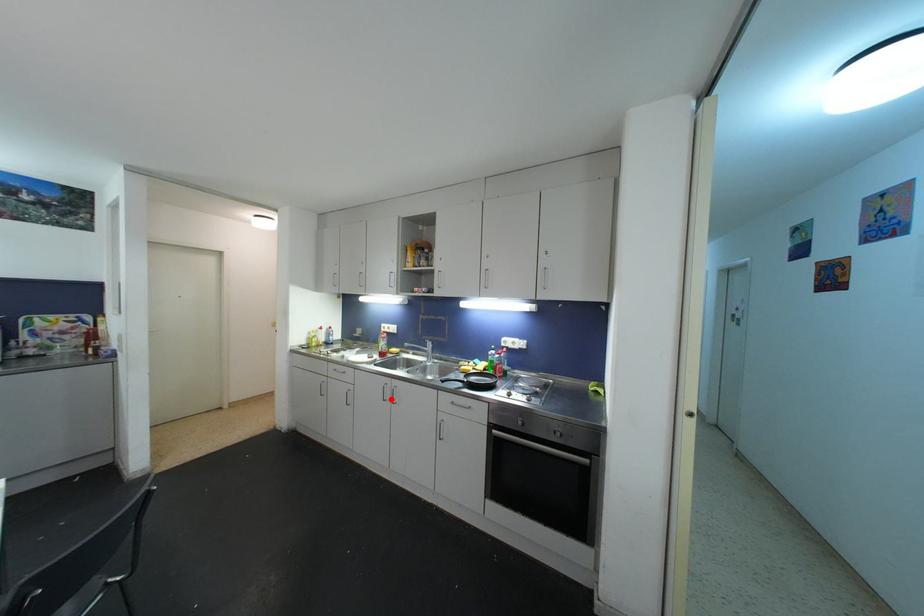
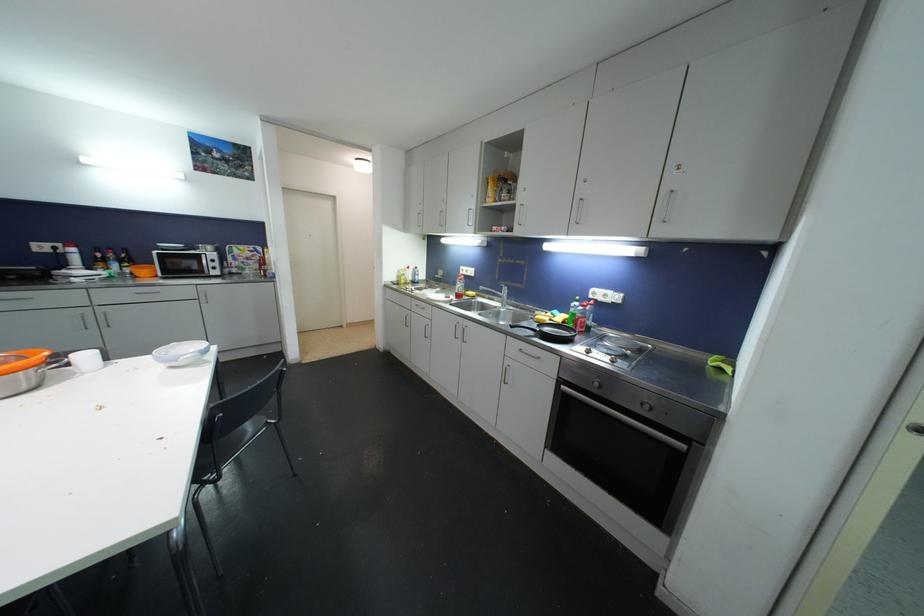
Find the pixel in the second image that matches the highlighted location in the first image.

(463, 338)